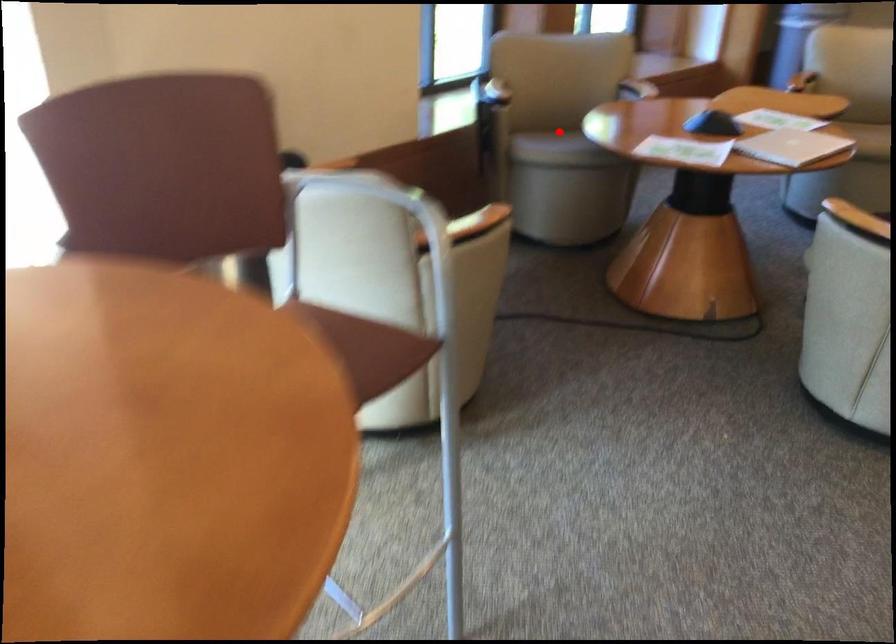
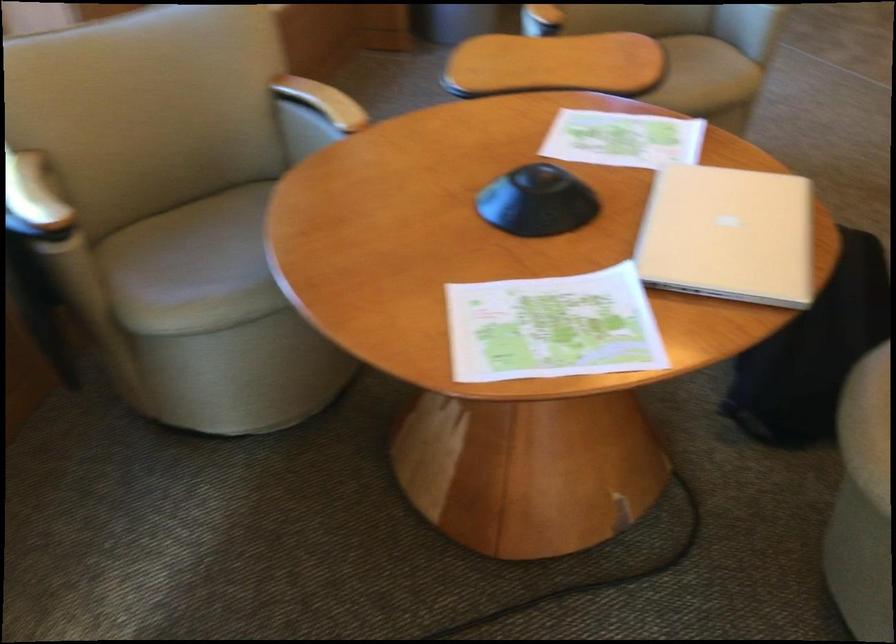
Question: I am providing you with two images of the same scene from different viewpoints. Given a red point in image1, look at the same physical point in image2. Is it:

Choices:
 (A) Closer to the viewpoint
 (B) Farther from the viewpoint

Answer: (A)